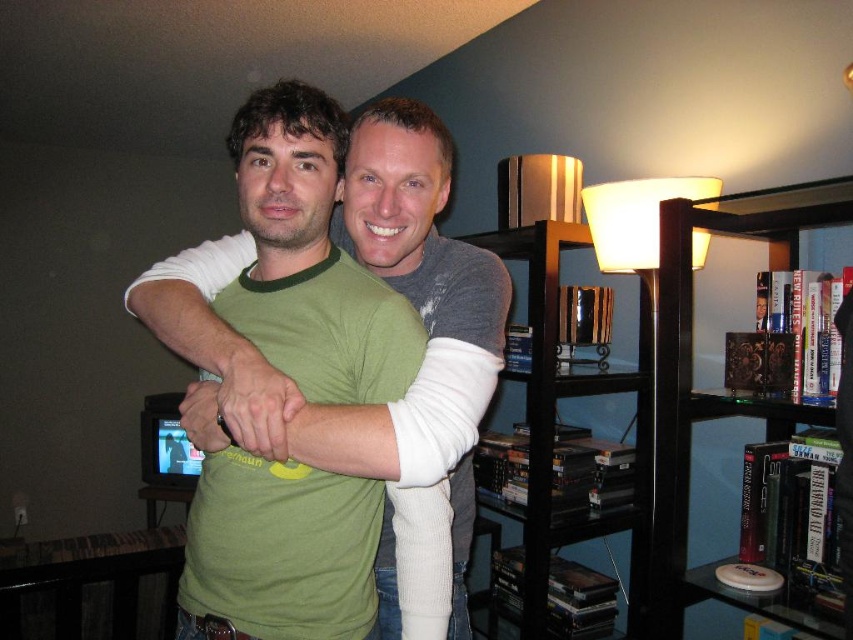
You are a delivery person who needs to place a large package between the transparent glass bookcase at right and the black glossy bookshelf at right. The package is 17 inches wide. Will it fit in the space between them?

The space between the transparent glass bookcase at right and the black glossy bookshelf at right is 18.32 inches. Since the package is 17 inches wide, it will fit as there is enough space.